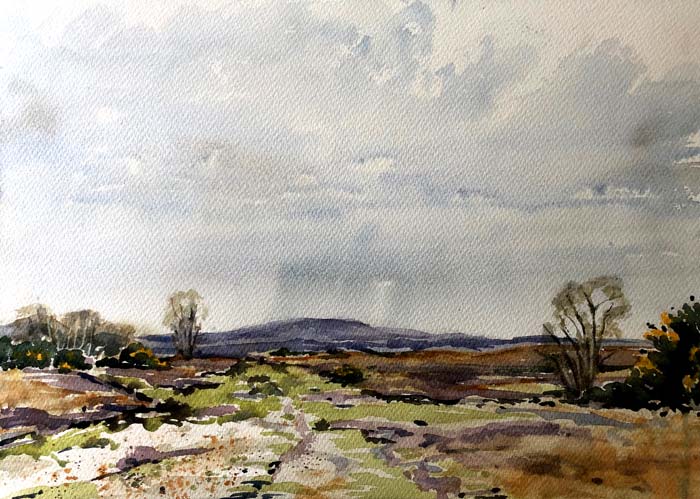
Identify the location of painting. The image size is (700, 499). (393, 198).